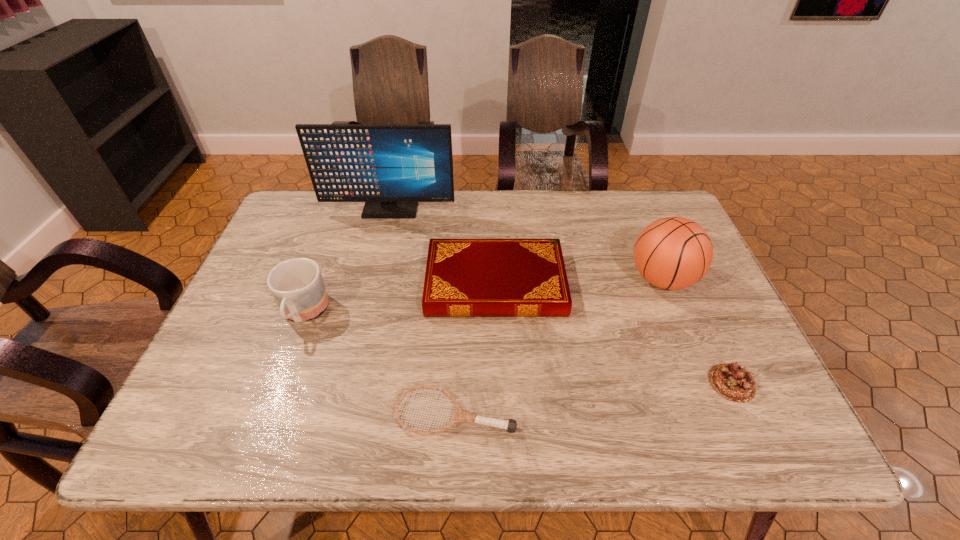
Identify the location of vacant space located 0.120m on the cover of the hardback book. (381, 283).

This screenshot has height=540, width=960. Find the location of `vacant position located on the cover of the hardback book`. vacant position located on the cover of the hardback book is located at coordinates (274, 283).

Locate an element on the screen. The width and height of the screenshot is (960, 540). blank space located on the cover of the hardback book is located at coordinates (308, 283).

The width and height of the screenshot is (960, 540). In order to click on free region located 0.320m on the left of the chocolate cake in this screenshot , I will do `click(559, 383)`.

Locate an element on the screen. The width and height of the screenshot is (960, 540). vacant space located on the right of the tennis racket is located at coordinates (639, 413).

Find the location of a particular element. object present at the far edge is located at coordinates (391, 167).

Find the location of a particular element. object that is at the near edge is located at coordinates (459, 415).

You are a GUI agent. You are given a task and a screenshot of the screen. Output one action in this format:
    pyautogui.click(x=<x>, y=<y>)
    Task: Click on the computer monitor positioned at the left edge
    The height and width of the screenshot is (540, 960).
    Given the screenshot: What is the action you would take?
    pyautogui.click(x=391, y=167)

The image size is (960, 540). Identify the location of mug located at the left edge. (297, 285).

Find the location of `basketball at the right edge`. basketball at the right edge is located at coordinates (673, 253).